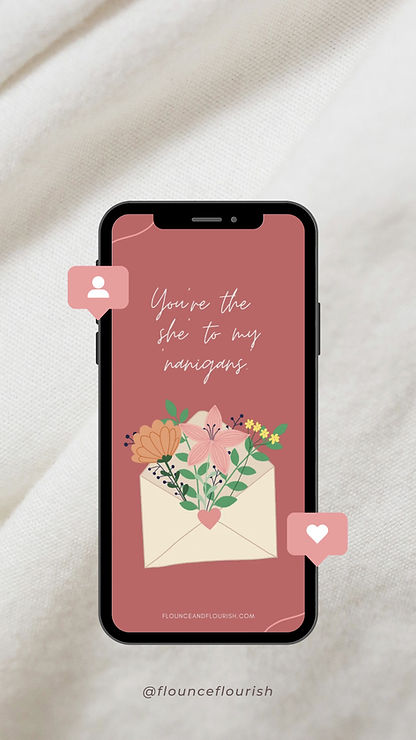
Find the location of a particular element. Image resolution: width=416 pixels, height=740 pixels. phone is located at coordinates [231, 272].